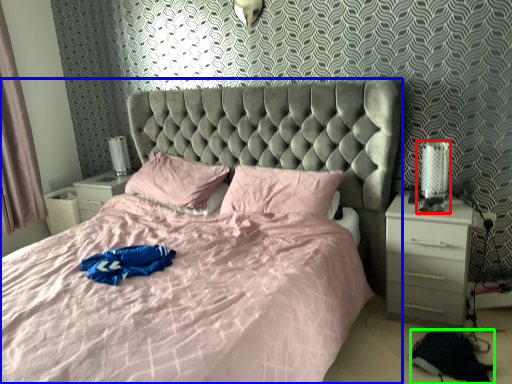
Question: Based on their relative distances, which object is nearer to table lamp (highlighted by a red box)? Choose from bed (highlighted by a blue box) and material (highlighted by a green box).

Choices:
 (A) bed
 (B) material

Answer: (B)